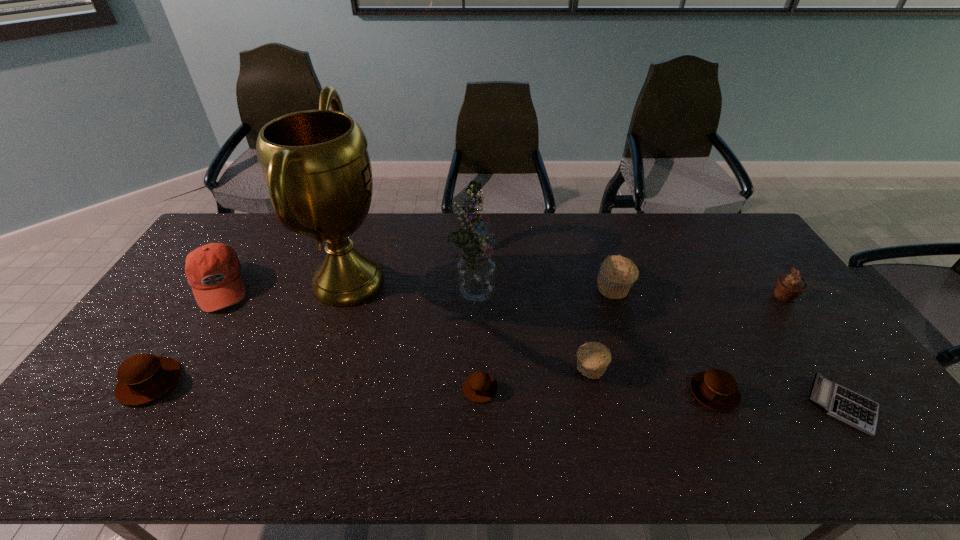
Locate an element on the screen. blank area in the image that satisfies the following two spatial constraints: 1. on the surface of the seventh object from left to right with symbols; 2. on the left side of the tallest object is located at coordinates (347, 288).

This screenshot has height=540, width=960. Identify the location of free spot that satisfies the following two spatial constraints: 1. on the front side of the second shortest muffin; 2. on the right side of the shortest object. (720, 404).

Locate an element on the screen. The width and height of the screenshot is (960, 540). free point that satisfies the following two spatial constraints: 1. on the front side of the shortest object; 2. on the right side of the eighth object from left to right is located at coordinates (720, 404).

The height and width of the screenshot is (540, 960). What are the coordinates of `vacant region that satisfies the following two spatial constraints: 1. on the back side of the smallest brown muffin; 2. on the surface of the trophy cup with symbols` in the screenshot? It's located at (480, 282).